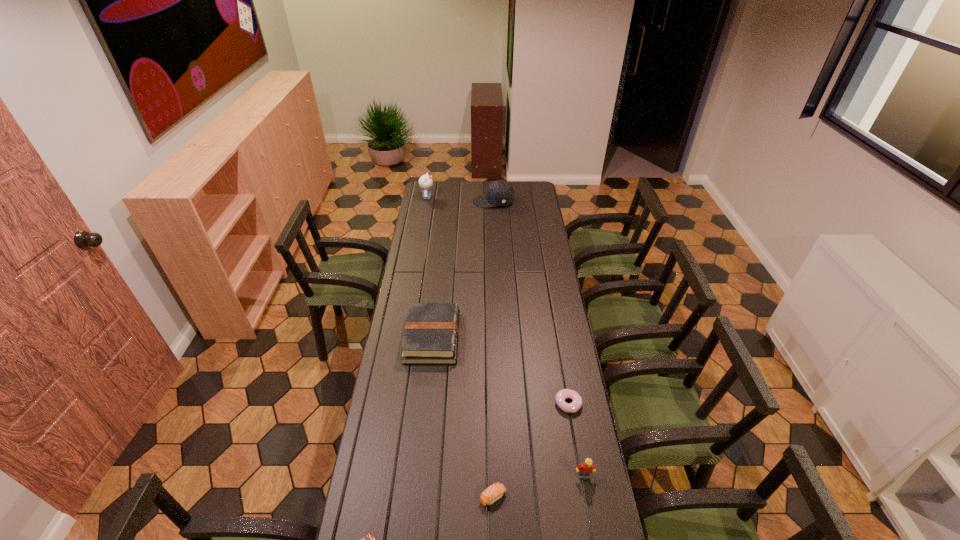
The width and height of the screenshot is (960, 540). Identify the location of empty space that is in between the baseball cap and the Lego. (539, 339).

Where is `empty location between the hardback book and the fourth nearest object`? The image size is (960, 540). empty location between the hardback book and the fourth nearest object is located at coordinates (500, 371).

You are a GUI agent. You are given a task and a screenshot of the screen. Output one action in this format:
    pyautogui.click(x=<x>, y=<y>)
    Task: Click on the vacant point located between the fourth farthest object and the kitten
    
    Given the screenshot: What is the action you would take?
    pyautogui.click(x=498, y=301)

This screenshot has height=540, width=960. I want to click on vacant point located between the third nearest object and the fourth nearest object, so click(x=576, y=440).

I want to click on empty location between the third nearest object and the kitten, so click(x=506, y=336).

What are the coordinates of `the sixth closest object to the chocolate bar` in the screenshot? It's located at (425, 182).

Identify the location of object that is the fifth closest to the Lego. [x=500, y=193].

Find the location of a particular element. Image resolution: width=960 pixels, height=540 pixels. vacant area in the image that satisfies the following two spatial constraints: 1. on the back side of the sushi; 2. on the front-facing side of the kitten is located at coordinates (487, 198).

Locate an element on the screen. vacant region that satisfies the following two spatial constraints: 1. on the spine side of the fourth shortest object; 2. on the back side of the sixth farthest object is located at coordinates tap(415, 497).

Identify the location of vacant area in the image that satisfies the following two spatial constraints: 1. on the spine side of the hardback book; 2. on the left side of the doughnut. (425, 404).